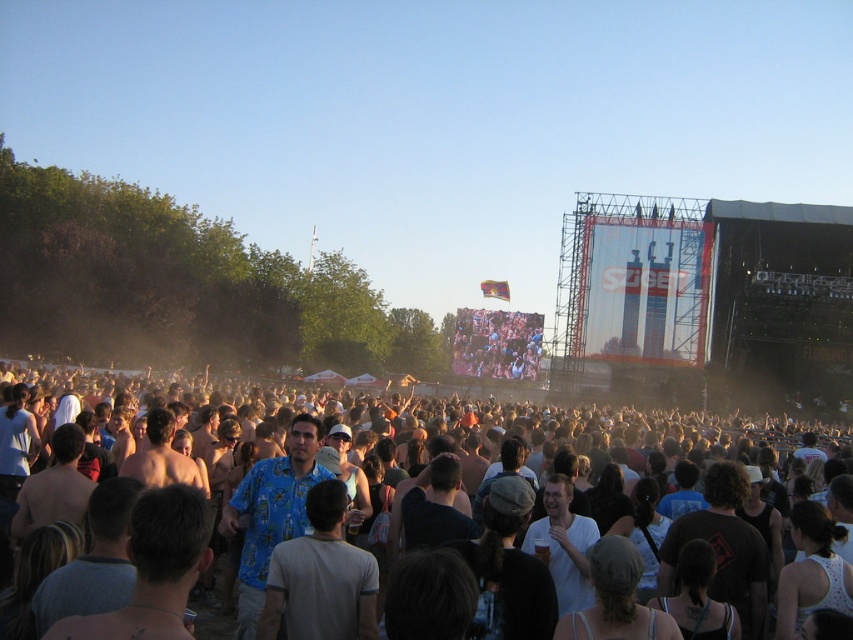
What do you see at coordinates (601, 436) in the screenshot? The height and width of the screenshot is (640, 853). I see `white cotton shirt at center` at bounding box center [601, 436].

Where is `white cotton shirt at center`? This screenshot has width=853, height=640. white cotton shirt at center is located at coordinates (601, 436).

Is point (270, 545) closer to viewer compared to point (531, 369)?

Yes, it is.

You are a GUI agent. You are given a task and a screenshot of the screen. Output one action in this format:
    pyautogui.click(x=<x>, y=<y>)
    Task: Click on the white cotton shirt at center
    
    Given the screenshot: What is the action you would take?
    pyautogui.click(x=601, y=436)